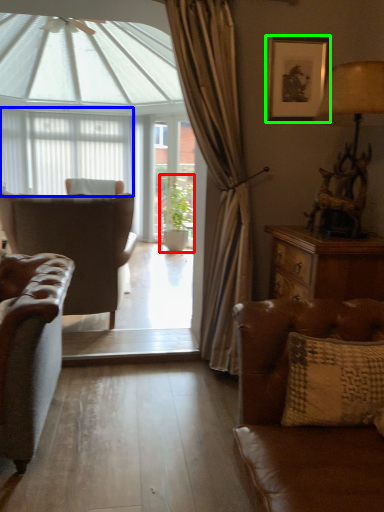
Question: Based on their relative distances, which object is nearer to houseplant (highlighted by a red box)? Choose from curtain (highlighted by a blue box) and picture frame (highlighted by a green box).

Choices:
 (A) curtain
 (B) picture frame

Answer: (A)